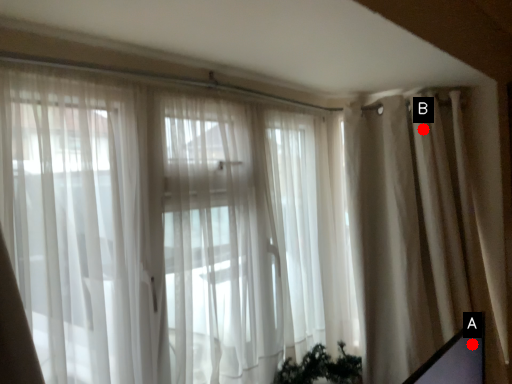
Question: Two points are circled on the image, labeled by A and B beside each circle. Which point is closer to the camera taking this photo?

Choices:
 (A) A is closer
 (B) B is closer

Answer: (A)